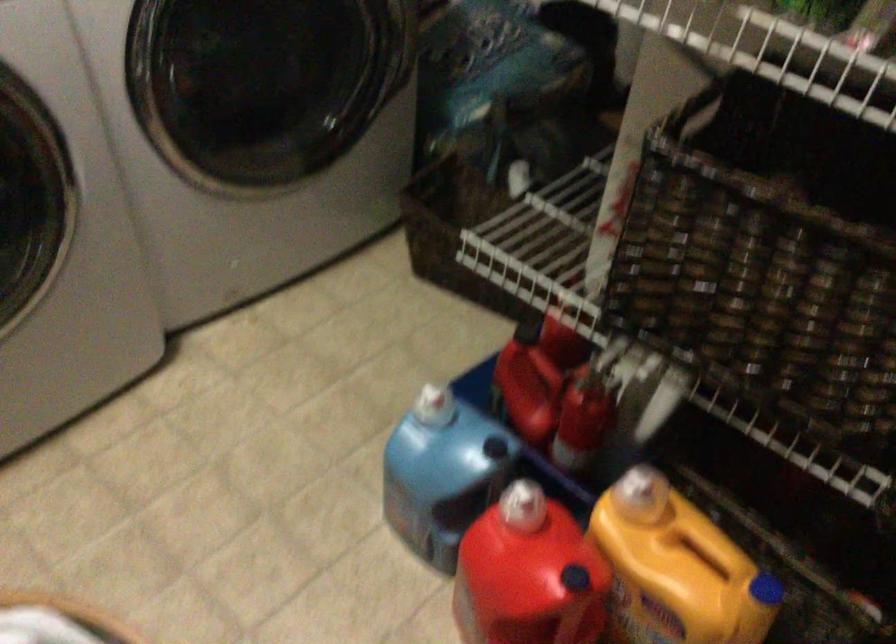
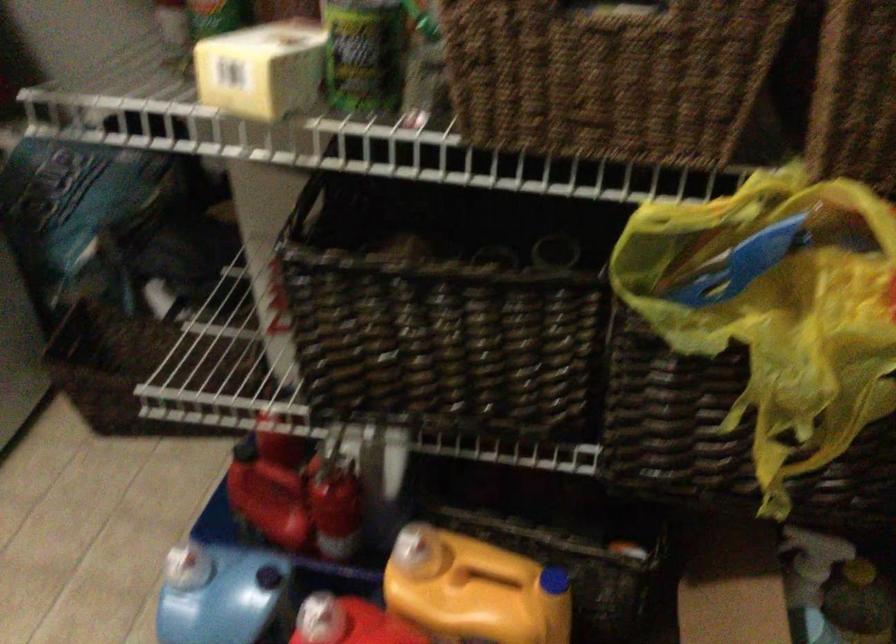
The point at [682,563] is marked in the first image. Where is the corresponding point in the second image?

(474, 590)